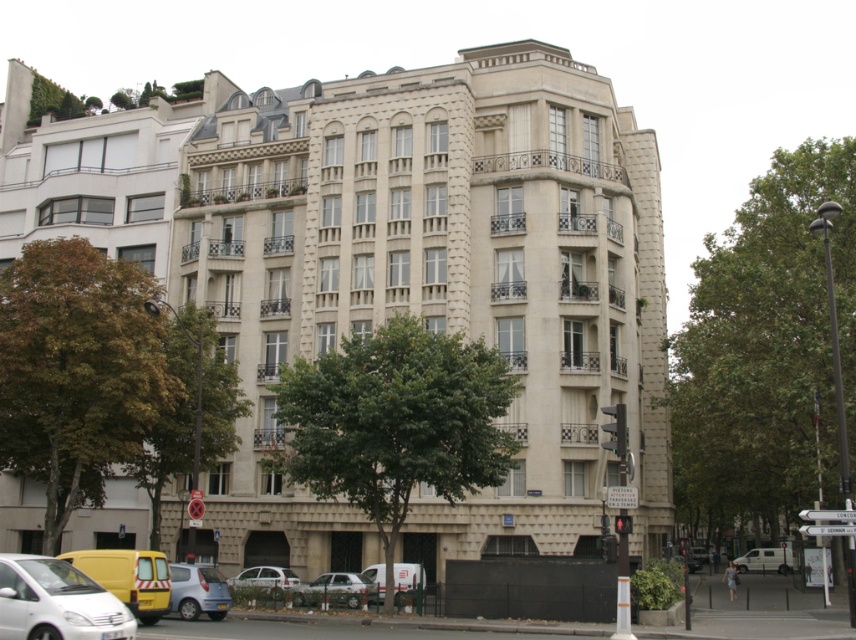
Question: Is white matte van at center thinner than white matte car at lower center?

Choices:
 (A) no
 (B) yes

Answer: (A)

Question: Based on their relative distances, which object is nearer to the white matte van at lower left?

Choices:
 (A) yellow matte van at lower left
 (B) white matte car at lower center

Answer: (A)

Question: Which object is the closest to the metallic silver car at lower center?

Choices:
 (A) white matte car at lower center
 (B) yellow matte van at lower left
 (C) white matte van at lower center

Answer: (B)

Question: Is beige stone building at center bigger than metallic silver car at lower center?

Choices:
 (A) yes
 (B) no

Answer: (A)

Question: Which point is farther to the camera?

Choices:
 (A) metallic silver car at lower center
 (B) white matte van at lower center
 (C) beige stone building at center
 (D) camouflage fabric car at lower center

Answer: (D)

Question: Can you confirm if metallic silver car at lower center is positioned to the left of camouflage fabric car at lower center?

Choices:
 (A) no
 (B) yes

Answer: (B)